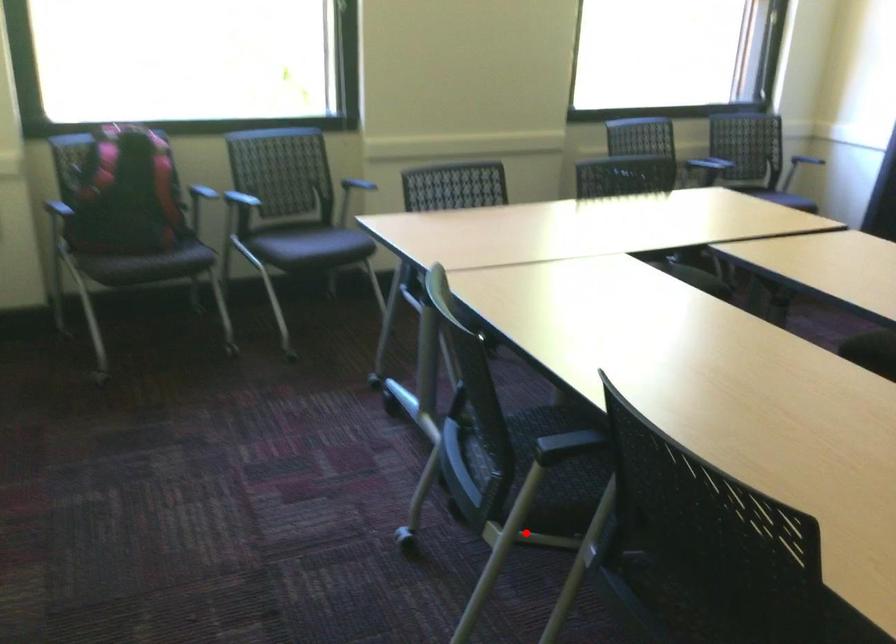
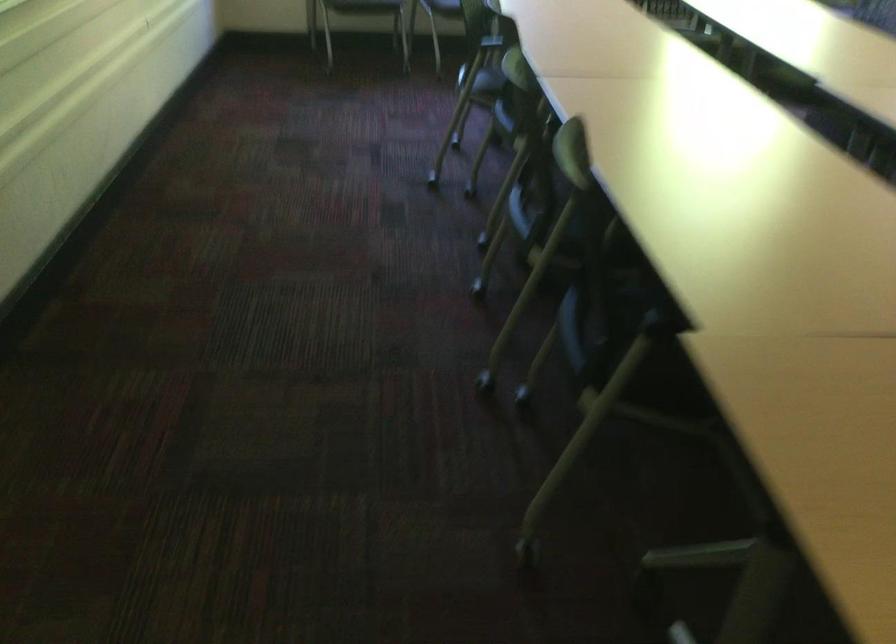
The point at the highlighted location is marked in the first image. Where is the corresponding point in the second image?

(478, 93)